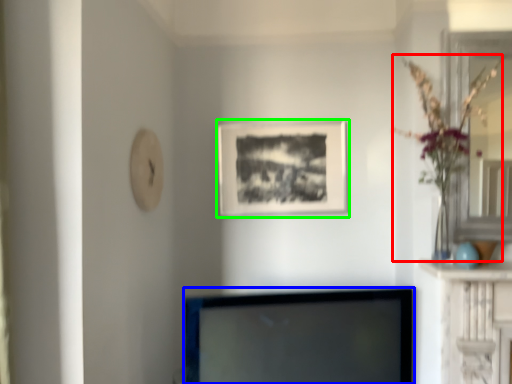
Question: Considering the real-world distances, which object is closest to floral arrangement (highlighted by a red box)? television (highlighted by a blue box) or picture frame (highlighted by a green box).

Choices:
 (A) television
 (B) picture frame

Answer: (B)